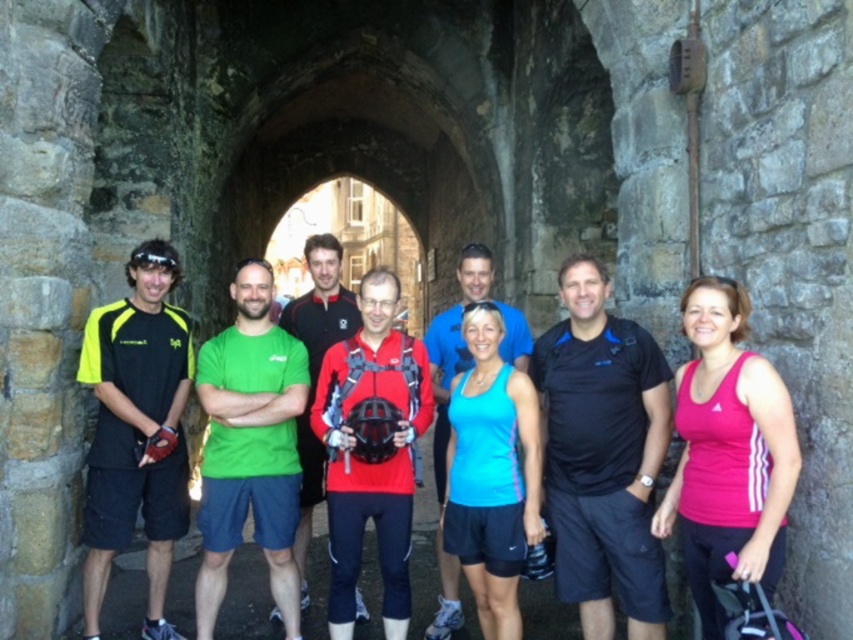
Question: Which point appears closest to the camera in this image?

Choices:
 (A) (x=306, y=477)
 (B) (x=730, y=477)
 (C) (x=514, y=326)
 (D) (x=202, y=508)

Answer: (B)

Question: Is black fabric shirt at center wider than neon yellow fabric shirt at left?

Choices:
 (A) no
 (B) yes

Answer: (A)

Question: Which point is closer to the camera taking this photo?

Choices:
 (A) coord(432,330)
 (B) coord(157,636)

Answer: (B)

Question: Observing the image, what is the correct spatial positioning of black fabric shirt at center in reference to red matte helmet at center?

Choices:
 (A) below
 (B) above

Answer: (A)

Question: Observing the image, what is the correct spatial positioning of black fabric shirt at center in reference to neon yellow fabric shirt at left?

Choices:
 (A) below
 (B) above

Answer: (B)

Question: Considering the real-world distances, which object is closest to the pink fabric tank top at right?

Choices:
 (A) neon yellow fabric shirt at left
 (B) blue fabric shirt at center

Answer: (B)